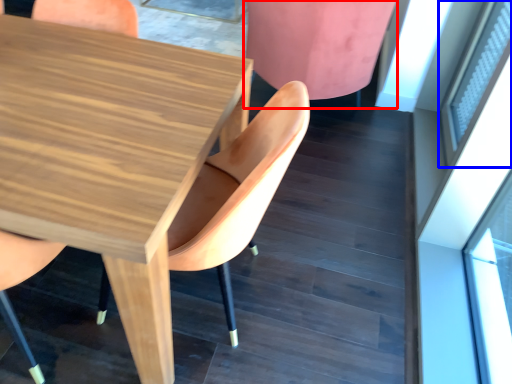
Question: Which object appears farthest to the camera in this image, chair (highlighted by a red box) or window (highlighted by a blue box)?

Choices:
 (A) chair
 (B) window

Answer: (A)